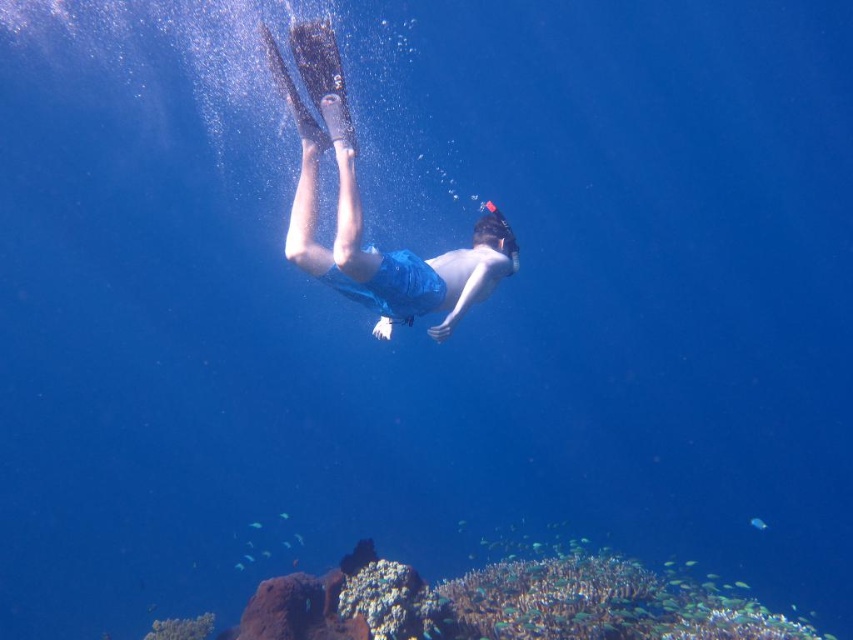
Question: Does white coral reef at lower center have a smaller size compared to blue fabric shorts at center?

Choices:
 (A) no
 (B) yes

Answer: (A)

Question: In this image, where is white coral reef at lower center located relative to blue fabric shorts at center?

Choices:
 (A) left
 (B) right

Answer: (B)

Question: Does white coral reef at lower center appear on the right side of blue fabric shorts at center?

Choices:
 (A) no
 (B) yes

Answer: (B)

Question: Which object is farther from the camera taking this photo?

Choices:
 (A) white coral reef at lower center
 (B) blue fabric shorts at center

Answer: (A)

Question: Among these points, which one is nearest to the camera?

Choices:
 (A) click(x=474, y=256)
 (B) click(x=476, y=614)

Answer: (A)

Question: Which point appears closest to the camera in this image?

Choices:
 (A) (525, 605)
 (B) (428, 276)

Answer: (B)